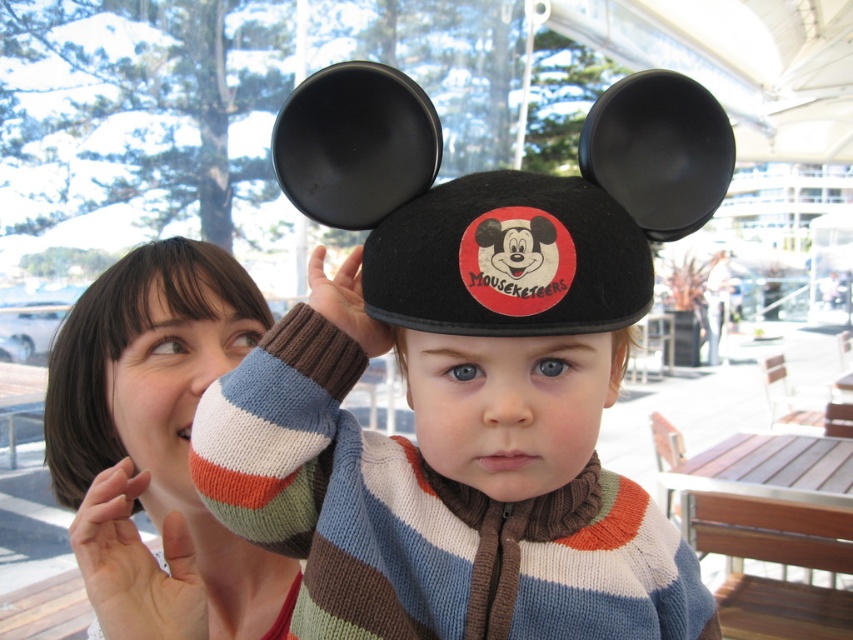
In the scene, you see a child wearing a black Mickey Mouse hat with a black felt ear at center and a black felt hat at center. Which object is positioned to the right side?

The black felt ear at center is to the right of the black felt hat at center.

You are standing in the scene and notice a point at coordinates (457, 429). Based on the scene description, what object is this point located on?

The point at coordinates (457, 429) is located on the fuzzy woolen hat at center.

Based on the photo, you are a photographer trying to capture a closeup of the child in the scene. The camera can only focus on objects that are at least 10 cm in size. The black felt hat at center and black felt ear at center are both in the frame. Based on their sizes, will the camera be able to focus on both objects?

The black felt hat at center is bigger than the black felt ear at center, but the exact sizes are not provided. However, since the hat is larger, it might meet the 10 cm requirement, while the ear might be smaller. Without specific measurements, it is uncertain if both will be in focus.